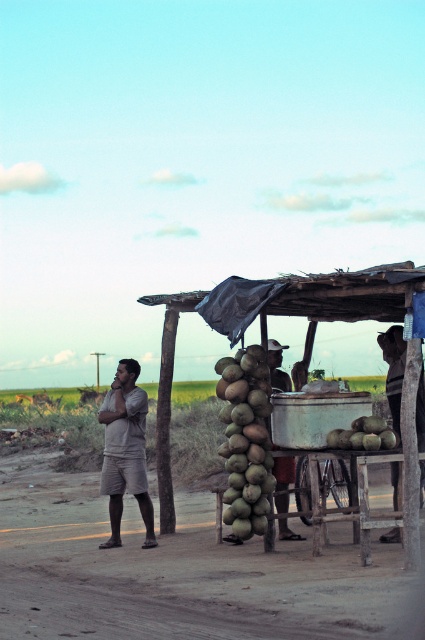
Consider the image. You are a traveler walking along the dirt road and see the light beige shorts at left and the brown leather hat at upper right. Which object is positioned lower in the image?

The light beige shorts at left is positioned lower than the brown leather hat at upper right.

Consider the image. You are a traveler standing on the dirt road and see the light beige shorts at left and the brown leather hat at center. Which object is taller?

The light beige shorts at left is much taller than the brown leather hat at center.